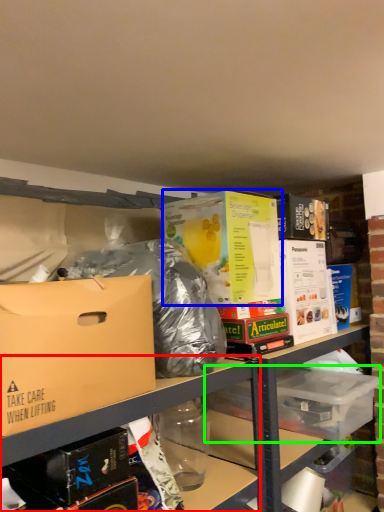
Question: Which object is positioned farthest from shelf (highlighted by a red box)? Select from box (highlighted by a blue box) and storage box (highlighted by a green box).

Choices:
 (A) box
 (B) storage box

Answer: (B)